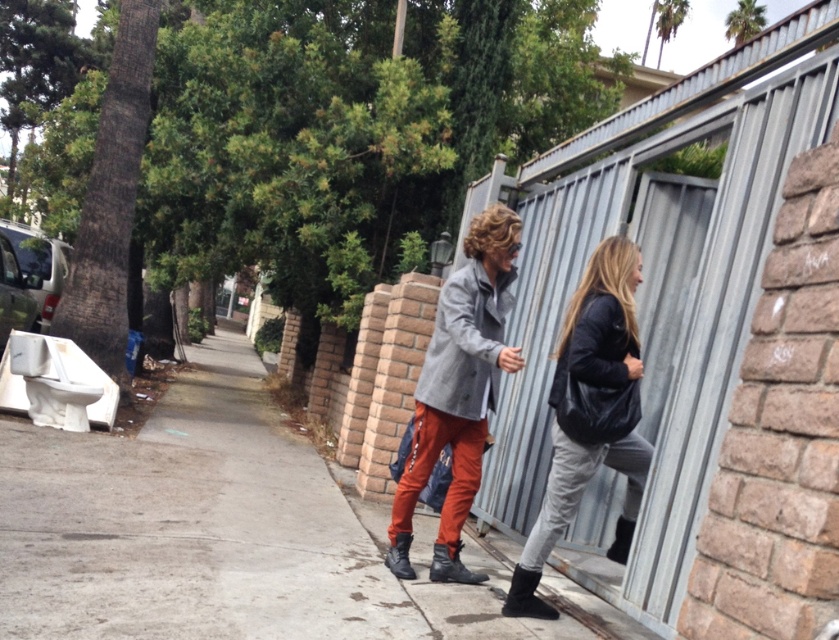
Question: Can you confirm if concrete sidewalk at center is thinner than black leather jacket at right?

Choices:
 (A) yes
 (B) no

Answer: (B)

Question: Among these points, which one is nearest to the camera?

Choices:
 (A) (25, 435)
 (B) (483, 348)
 (C) (571, 300)

Answer: (B)

Question: Which point is closer to the camera?

Choices:
 (A) matte gray coat at center
 (B) concrete sidewalk at center
 (C) black leather jacket at right

Answer: (B)

Question: Can you confirm if concrete sidewalk at center is positioned below matte gray coat at center?

Choices:
 (A) yes
 (B) no

Answer: (A)

Question: Does concrete sidewalk at center have a lesser width compared to matte gray coat at center?

Choices:
 (A) no
 (B) yes

Answer: (A)

Question: Which object appears farthest from the camera in this image?

Choices:
 (A) black leather jacket at right
 (B) concrete sidewalk at center

Answer: (A)